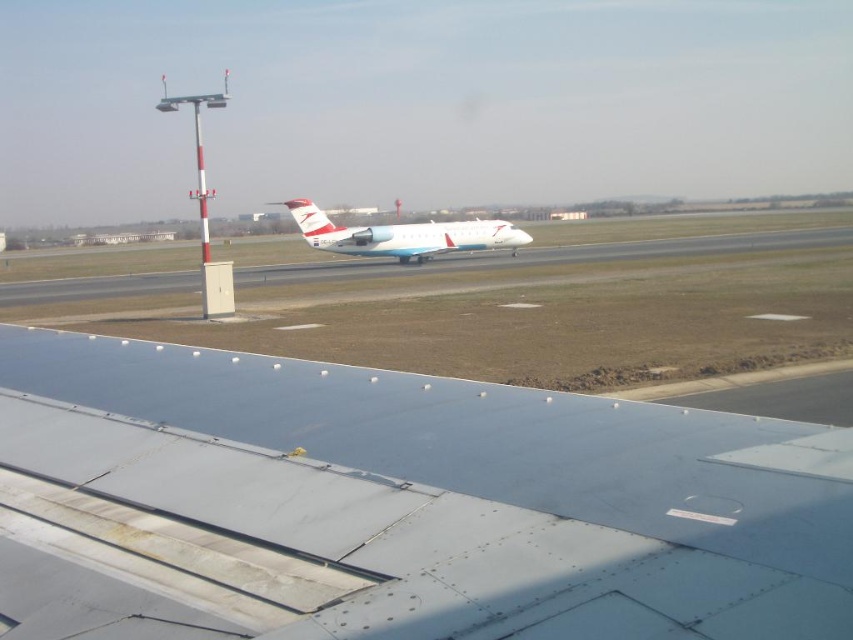
Question: Which of the following is the closest to the observer?

Choices:
 (A) (527, 561)
 (B) (410, 237)

Answer: (A)

Question: Can you confirm if metallic gray wing at lower center is positioned to the right of white glossy airplane at center?

Choices:
 (A) no
 (B) yes

Answer: (B)

Question: Is metallic gray wing at lower center positioned in front of white glossy airplane at center?

Choices:
 (A) no
 (B) yes

Answer: (B)

Question: Which of the following is the farthest from the observer?

Choices:
 (A) (686, 627)
 (B) (358, 234)

Answer: (B)

Question: Is metallic gray wing at lower center to the right of white glossy airplane at center from the viewer's perspective?

Choices:
 (A) yes
 (B) no

Answer: (A)